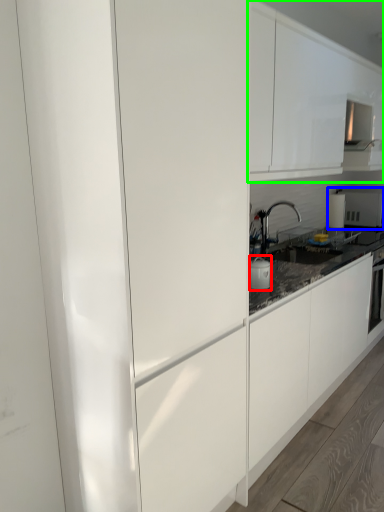
Question: Which is nearer to the appliance (highlighted by a red box)? appliance (highlighted by a blue box) or cabinetry (highlighted by a green box).

Choices:
 (A) appliance
 (B) cabinetry

Answer: (B)